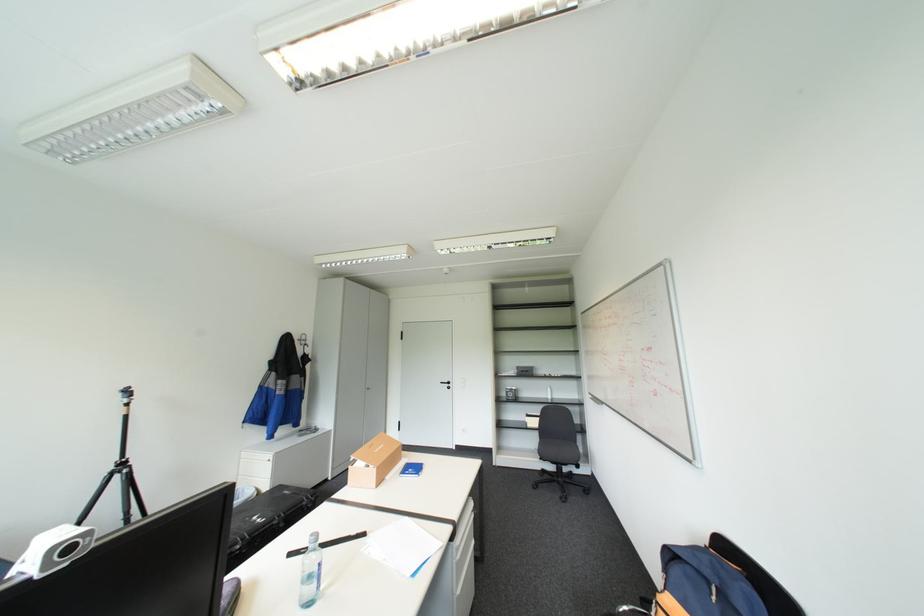
The image size is (924, 616). What do you see at coordinates (712, 584) in the screenshot?
I see `the chair armrest` at bounding box center [712, 584].